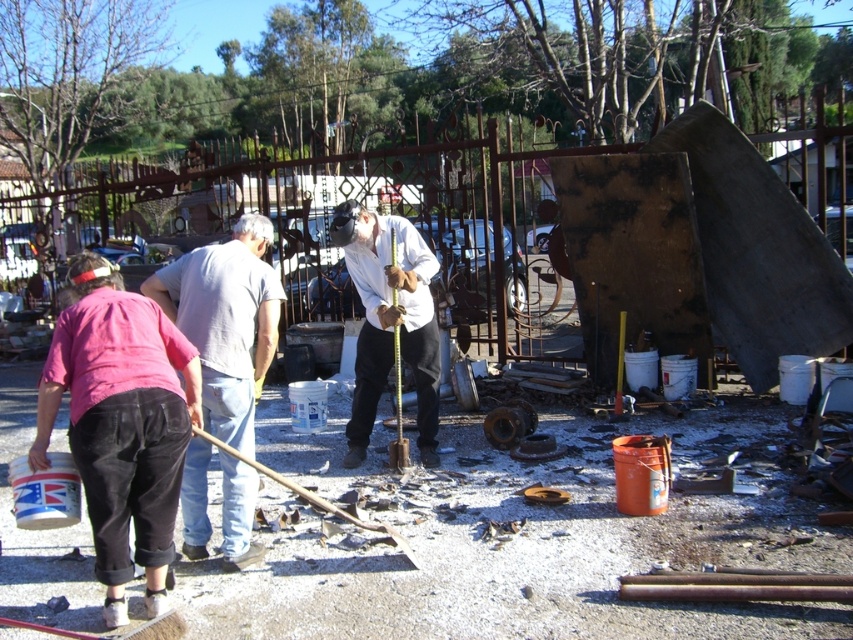
You are standing in the yard looking at the debris. There are two points marked in the scene, one at coordinates point (173,308) and another at point (425,304). Which point is closer to your current position?

Point (173,308) is closer to the camera than point (425,304), so the point at coordinates point (173,308) is closer to your current position.

You are standing in the yard and want to pick up the pink fabric shirt at lower left. Is the white matte cement at center blocking your path to it?

The white matte cement at center is further to the viewer than the pink fabric shirt at lower left, so it is closer to you and would block your path to the pink fabric shirt at lower left.

You are a worker standing in the yard and need to reach the white matte cement at center and the white matte shirt at center. Which object is closer to you?

The white matte cement at center is closer to the viewer than the white matte shirt at center.